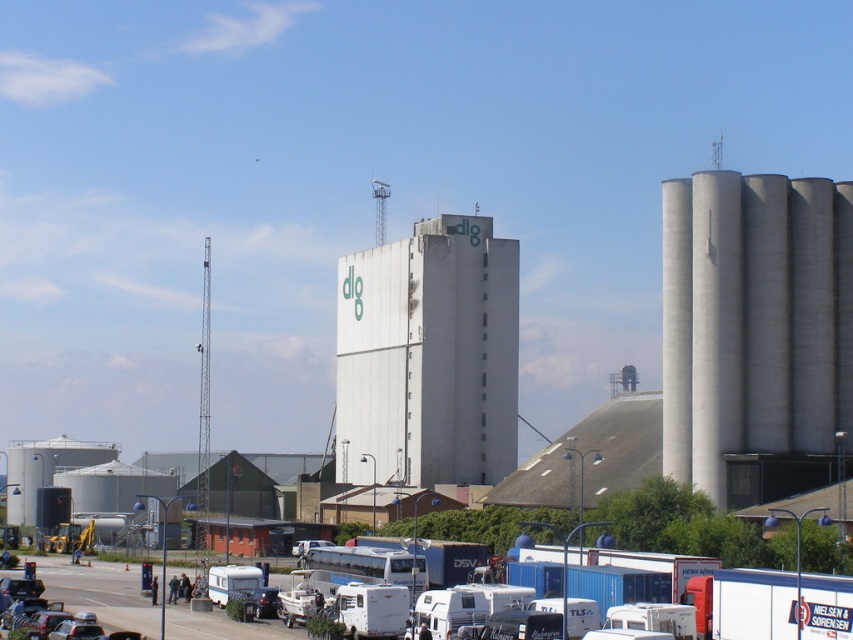
You are driving a delivery truck and need to park it in the parking lot shown in the image. The truck is the same width as the white matte camper van at center. There is a space next to the gray concrete silo at right. Do you think your truck will fit in that space?

The gray concrete silo at right is wider than the white matte camper van at center. Since your truck has the same width as the camper van, the space next to the silo is wider than your truck, so it will fit.

You are a delivery driver who needs to park your truck in the parking lot. You see a gray concrete silo at right and a white matte camper van at center. Which object is located to the right of the other?

The gray concrete silo at right is located to the right of the white matte camper van at center.

You are standing at the entrance of the industrial area and want to locate the white concrete silo at center. According to the map, your current position is at point 0.558, 0.503. Is the silo directly in front of you?

The white concrete silo at center is located exactly at your current position at point (x=428, y=356), so you are already standing at the silo.